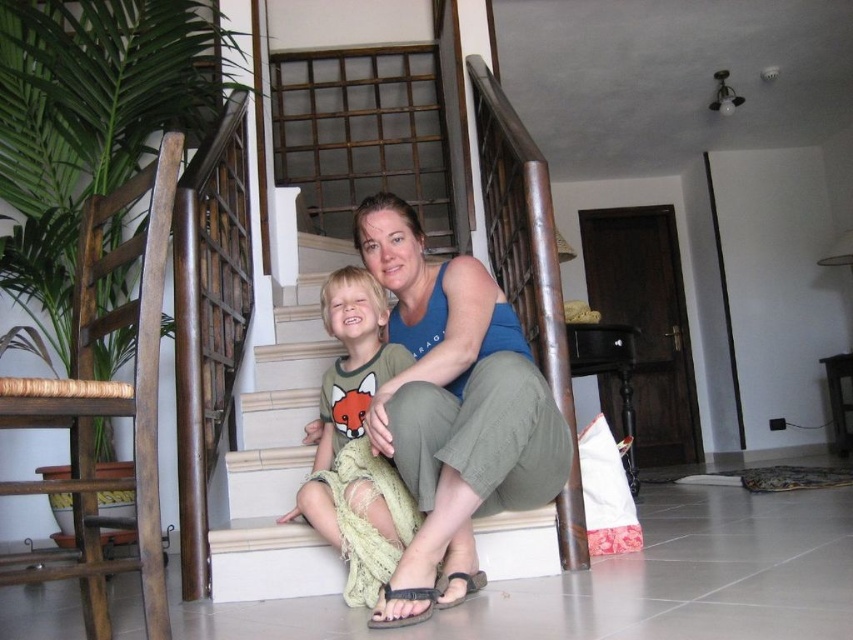
Question: Which of the following is the farthest from the observer?

Choices:
 (A) white concrete stairs at center
 (B) brown leather sandal at lower center

Answer: (A)

Question: Is black fabric sandal at lower center positioned behind brown leather sandal at lower center?

Choices:
 (A) no
 (B) yes

Answer: (A)

Question: Among these points, which one is nearest to the camera?

Choices:
 (A) (447, 579)
 (B) (376, 624)

Answer: (B)

Question: In this image, where is white concrete stairs at center located relative to brown leather sandal at lower center?

Choices:
 (A) right
 (B) left

Answer: (B)

Question: Among these objects, which one is farthest from the camera?

Choices:
 (A) black fabric sandal at lower center
 (B) brown leather sandal at lower center

Answer: (B)

Question: In this image, where is white concrete stairs at center located relative to black fabric sandal at lower center?

Choices:
 (A) left
 (B) right

Answer: (A)